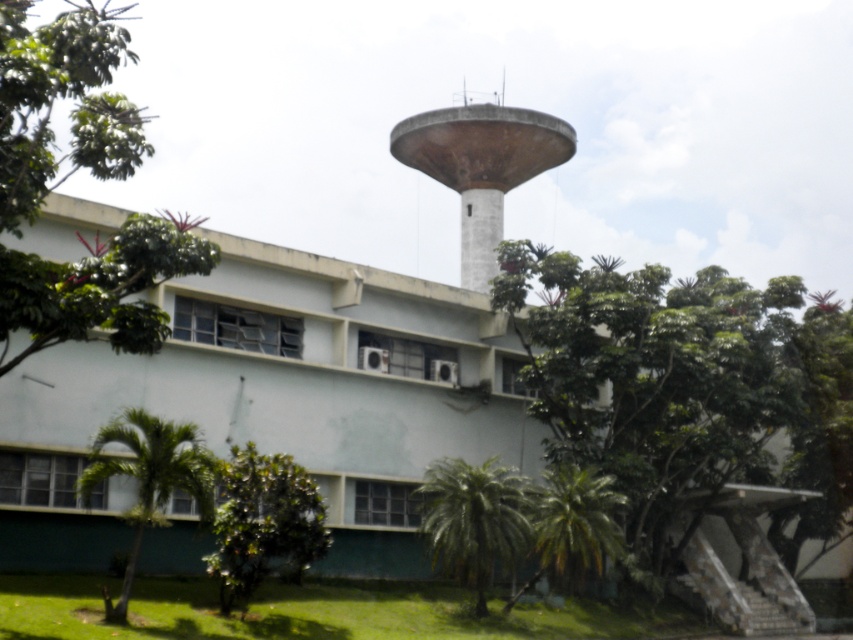
Is point (440, 120) more distant than point (445, 518)?

That is True.

Between concrete water tower at upper center and green leafy palm at lower center, which one appears on the left side from the viewer's perspective?

green leafy palm at lower center is more to the left.

Between point (427, 116) and point (526, 550), which one is positioned in front?

Point (526, 550) is in front.

Locate an element on the screen. The height and width of the screenshot is (640, 853). concrete water tower at upper center is located at coordinates (480, 166).

Is green leafy tree at lower left closer to camera compared to green leafy palm at lower left?

No, green leafy tree at lower left is behind green leafy palm at lower left.

In the scene shown: Which of these two, green leafy tree at lower left or green leafy palm at lower left, stands taller?

Standing taller between the two is green leafy tree at lower left.

Is point (219, 513) farther from viewer compared to point (99, 445)?

Yes, it is.

This screenshot has height=640, width=853. What are the coordinates of `green leafy tree at lower left` in the screenshot? It's located at (263, 524).

Does green leafy tree at lower right lie in front of green leafy palm at lower right?

No, it is not.

Which is below, green leafy tree at lower right or green leafy palm at lower right?

green leafy palm at lower right is lower down.

What do you see at coordinates (683, 384) in the screenshot? I see `green leafy tree at lower right` at bounding box center [683, 384].

Identify the location of green leafy tree at lower right. (683, 384).